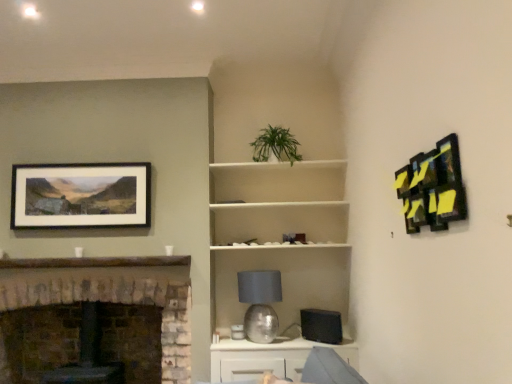
Question: Should I look upward or downward to see abstract painting at upper right, positioned as the first picture frame in front-to-back order?

Choices:
 (A) down
 (B) up

Answer: (B)

Question: Is stone fireplace at left oriented towards white matte shelf at center?

Choices:
 (A) no
 (B) yes

Answer: (A)

Question: From the image's perspective, would you say stone fireplace at left is positioned over white matte shelf at center?

Choices:
 (A) yes
 (B) no

Answer: (B)

Question: Is stone fireplace at left in contact with white matte shelf at center?

Choices:
 (A) no
 (B) yes

Answer: (A)

Question: Is stone fireplace at left to the right of white matte shelf at center from the viewer's perspective?

Choices:
 (A) yes
 (B) no

Answer: (B)

Question: Are stone fireplace at left and white matte shelf at center far apart?

Choices:
 (A) no
 (B) yes

Answer: (A)

Question: Can you confirm if stone fireplace at left is positioned to the left of white matte shelf at center?

Choices:
 (A) no
 (B) yes

Answer: (B)

Question: Considering the relative sizes of white matte shelf at center and silver metallic table lamp at center in the image provided, is white matte shelf at center wider than silver metallic table lamp at center?

Choices:
 (A) yes
 (B) no

Answer: (A)

Question: Is white matte shelf at center far from silver metallic table lamp at center?

Choices:
 (A) no
 (B) yes

Answer: (A)

Question: Is white matte shelf at center to the left of silver metallic table lamp at center from the viewer's perspective?

Choices:
 (A) yes
 (B) no

Answer: (B)

Question: From the image's perspective, is white matte shelf at center under silver metallic table lamp at center?

Choices:
 (A) yes
 (B) no

Answer: (B)

Question: Considering the relative sizes of white matte shelf at center and silver metallic table lamp at center in the image provided, is white matte shelf at center bigger than silver metallic table lamp at center?

Choices:
 (A) yes
 (B) no

Answer: (A)

Question: From the image's perspective, would you say white matte shelf at center is positioned over silver metallic table lamp at center?

Choices:
 (A) no
 (B) yes

Answer: (B)

Question: Could you tell me if matte black picture frame at upper left, acting as the first picture frame starting from the left, is facing white matte shelf at center?

Choices:
 (A) no
 (B) yes

Answer: (A)